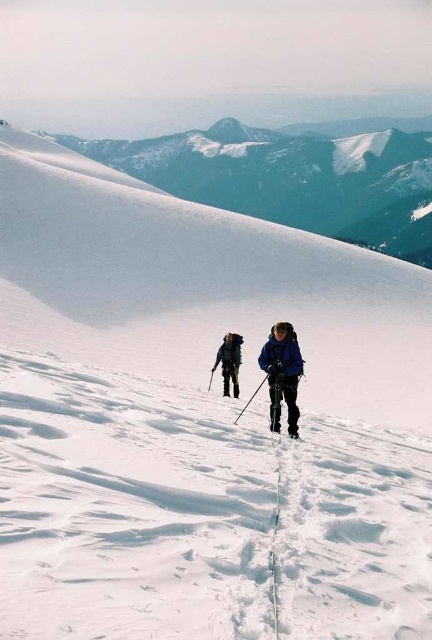
Question: Which of these objects is positioned closest to the dark blue jacket at center?

Choices:
 (A) black matte ski at center
 (B) blue fabric jacket at center

Answer: (B)

Question: Can you confirm if blue fabric jacket at center is wider than dark blue jacket at center?

Choices:
 (A) no
 (B) yes

Answer: (A)

Question: Estimate the real-world distances between objects in this image. Which object is closer to the dark blue jacket at center?

Choices:
 (A) black matte ski at center
 (B) blue fabric jacket at center

Answer: (B)

Question: From the image, what is the correct spatial relationship of dark blue jacket at center in relation to black matte ski at center?

Choices:
 (A) left
 (B) right

Answer: (A)

Question: Which object is closer to the camera taking this photo?

Choices:
 (A) dark blue jacket at center
 (B) black matte ski at center

Answer: (B)

Question: Can you confirm if blue fabric jacket at center is smaller than black matte ski at center?

Choices:
 (A) yes
 (B) no

Answer: (B)